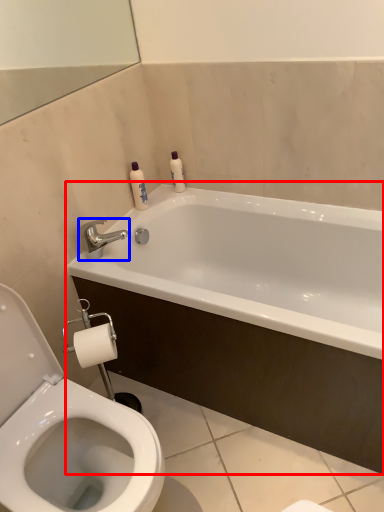
Question: Which object is closer to the camera taking this photo, bathtub (highlighted by a red box) or tap (highlighted by a blue box)?

Choices:
 (A) bathtub
 (B) tap

Answer: (A)